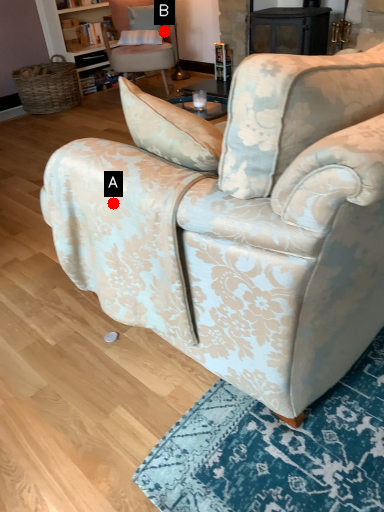
Question: Two points are circled on the image, labeled by A and B beside each circle. Which point appears farthest from the camera in this image?

Choices:
 (A) A is further
 (B) B is further

Answer: (B)